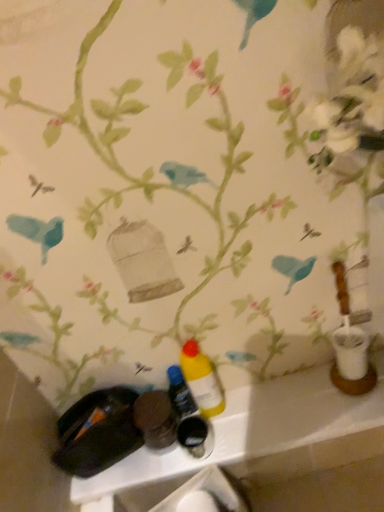
Question: In terms of size, does yellow matte bottle at center, which is counted as the 2th bottle, starting from the left, appear bigger or smaller than yellow matte bottle at center, marked as the second bottle in a right-to-left arrangement?

Choices:
 (A) big
 (B) small

Answer: (A)

Question: Considering the positions of yellow matte bottle at center, which ranks as the 1th bottle in right-to-left order, and yellow matte bottle at center, which is counted as the 1th bottle, starting from the left, in the image, is yellow matte bottle at center, which ranks as the 1th bottle in right-to-left order, taller or shorter than yellow matte bottle at center, which is counted as the 1th bottle, starting from the left,?

Choices:
 (A) tall
 (B) short

Answer: (A)

Question: Which is farther from the yellow matte bottle at center, marked as the second bottle in a right-to-left arrangement?

Choices:
 (A) yellow matte bottle at center, which ranks as the 1th bottle in right-to-left order
 (B) matte plastic bottles at lower center

Answer: (B)

Question: Estimate the real-world distances between objects in this image. Which object is farther from the matte plastic bottles at lower center?

Choices:
 (A) yellow matte bottle at center, which is counted as the 2th bottle, starting from the left
 (B) yellow matte bottle at center, which is counted as the 1th bottle, starting from the left

Answer: (B)